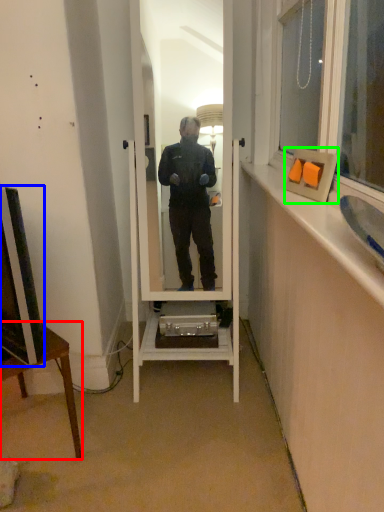
Question: Which object is the closest to the desk (highlighted by a red box)? Choose among these: television (highlighted by a blue box) or picture frame (highlighted by a green box).

Choices:
 (A) television
 (B) picture frame

Answer: (A)